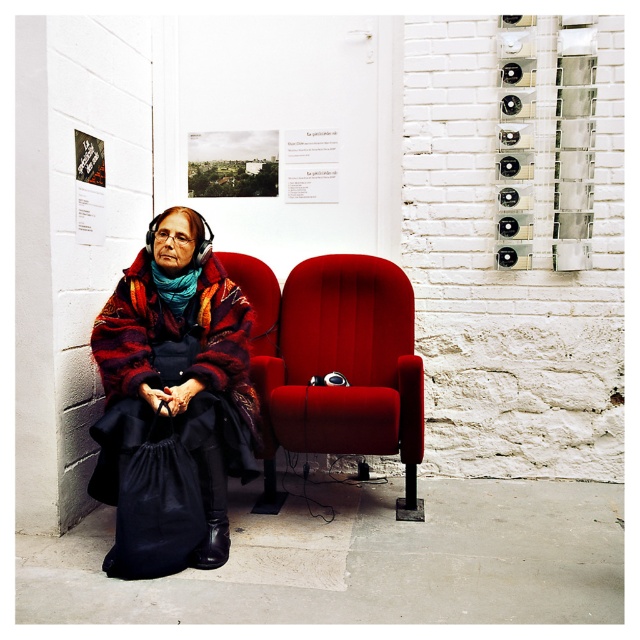
Question: Among these objects, which one is farthest from the camera?

Choices:
 (A) teal knitted scarf at left
 (B) velvet-like scarf at center
 (C) velvet red armchair at center

Answer: (A)

Question: Which point appears closest to the camera in this image?

Choices:
 (A) (269, 506)
 (B) (188, 275)
 (C) (104, 561)

Answer: (C)

Question: Is the position of velvet-like scarf at center more distant than that of teal knitted scarf at left?

Choices:
 (A) yes
 (B) no

Answer: (B)

Question: Can you confirm if velvet-like scarf at center is positioned to the right of velvet red armchair at center?

Choices:
 (A) no
 (B) yes

Answer: (A)

Question: Is velvet-like scarf at center further to the viewer compared to velvet red armchair at center?

Choices:
 (A) yes
 (B) no

Answer: (B)

Question: Among these points, which one is farthest from the camera?

Choices:
 (A) (116, 308)
 (B) (150, 266)
 (C) (328, 257)

Answer: (C)